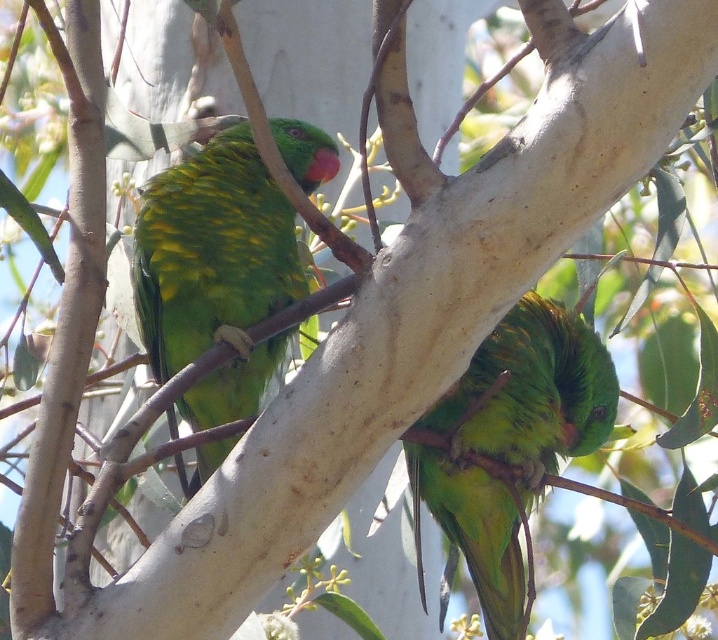
Question: Which of the following is the closest to the observer?

Choices:
 (A) (281, 241)
 (B) (569, 362)

Answer: (B)

Question: Is green matte parrot at upper left to the left of green matte parrot at center from the viewer's perspective?

Choices:
 (A) no
 (B) yes

Answer: (B)

Question: Does green matte parrot at upper left have a greater width compared to green matte parrot at center?

Choices:
 (A) yes
 (B) no

Answer: (B)

Question: Which point is farther from the camera taking this photo?

Choices:
 (A) coord(500,420)
 (B) coord(271,186)

Answer: (B)

Question: Does green matte parrot at upper left appear over green matte parrot at center?

Choices:
 (A) yes
 (B) no

Answer: (A)